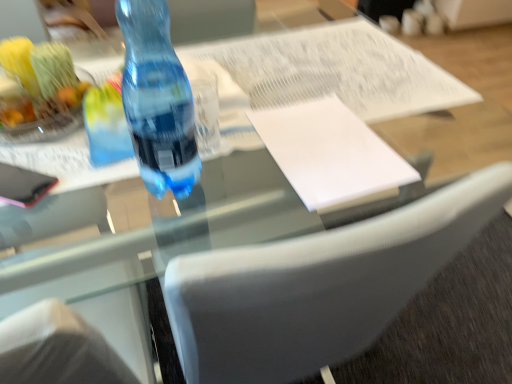
Find the location of a particular element. The width and height of the screenshot is (512, 384). vacant space behind white paper at center is located at coordinates (317, 80).